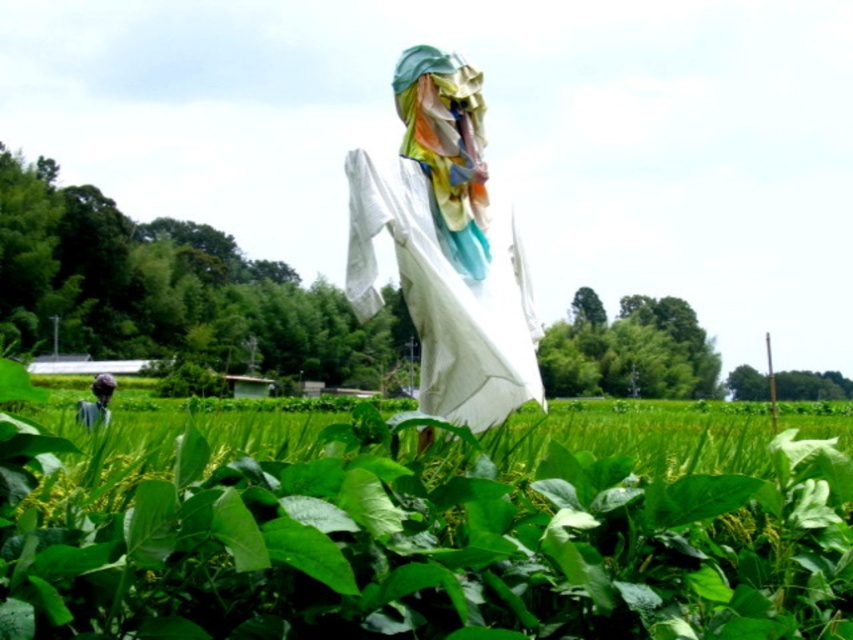
Can you confirm if white cloth at center is positioned to the right of dark blue fabric at lower left?

Yes, white cloth at center is to the right of dark blue fabric at lower left.

Is point (479, 198) more distant than point (109, 384)?

No, (479, 198) is in front of (109, 384).

I want to click on white cloth at center, so (x=445, y=246).